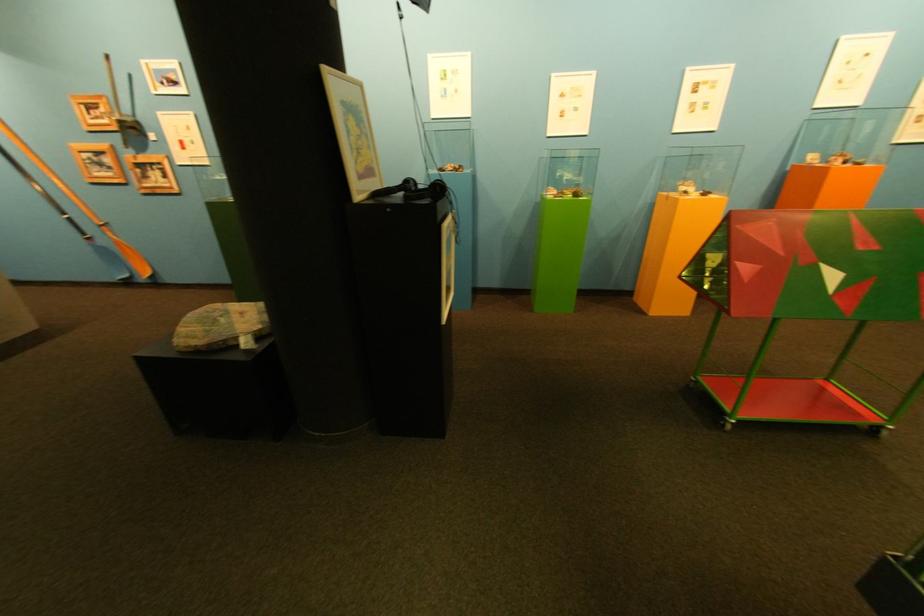
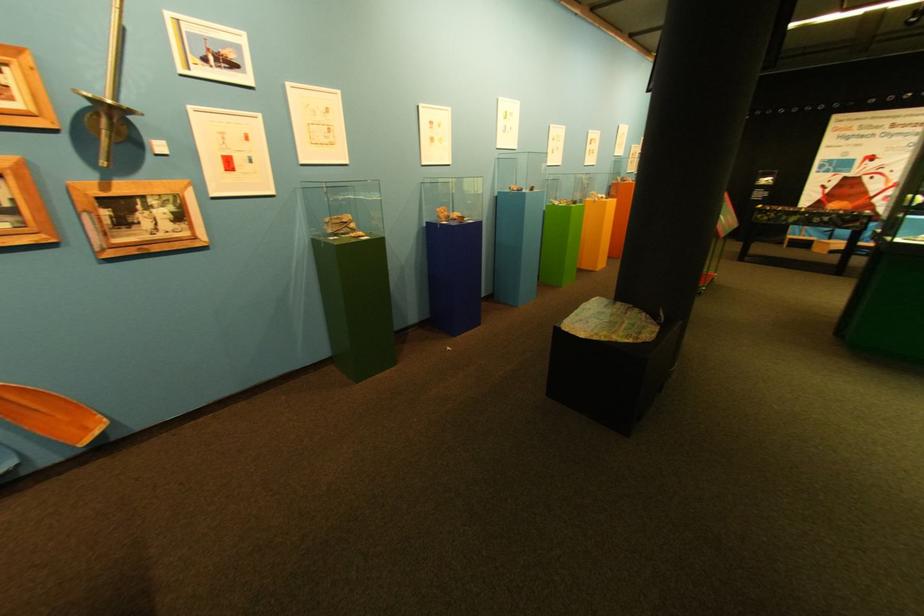
In the second image, find the point that corresponds to point 135,245 in the first image.

(6, 397)